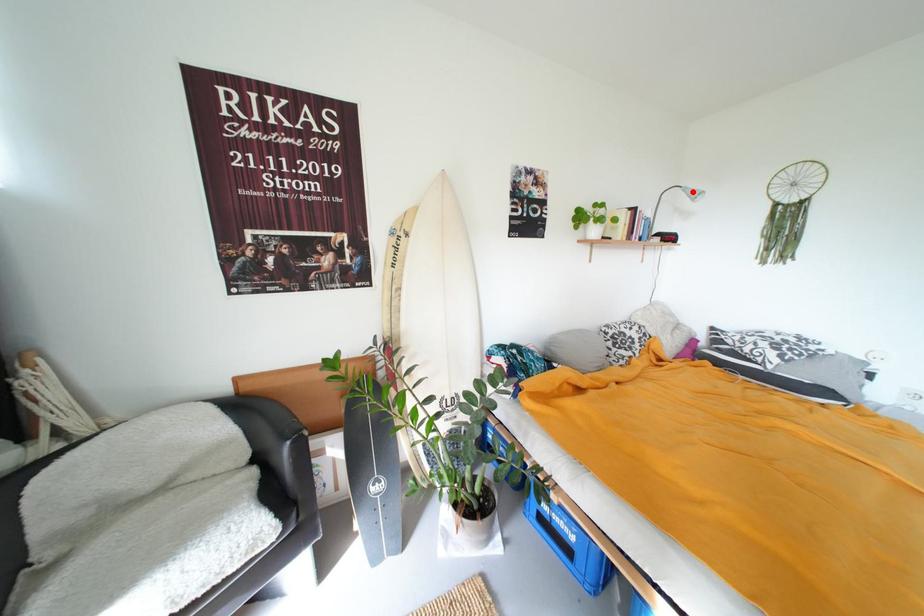
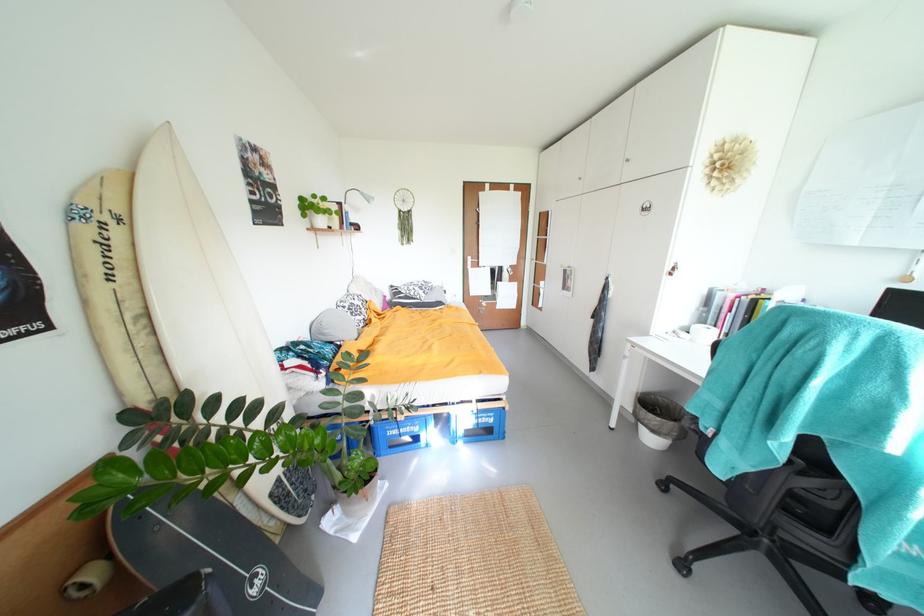
Question: I am providing you with two images of the same scene from different viewpoints. A red point is marked on the first image. Is the red point's position out of view in image 2?

Choices:
 (A) Yes
 (B) No

Answer: (B)